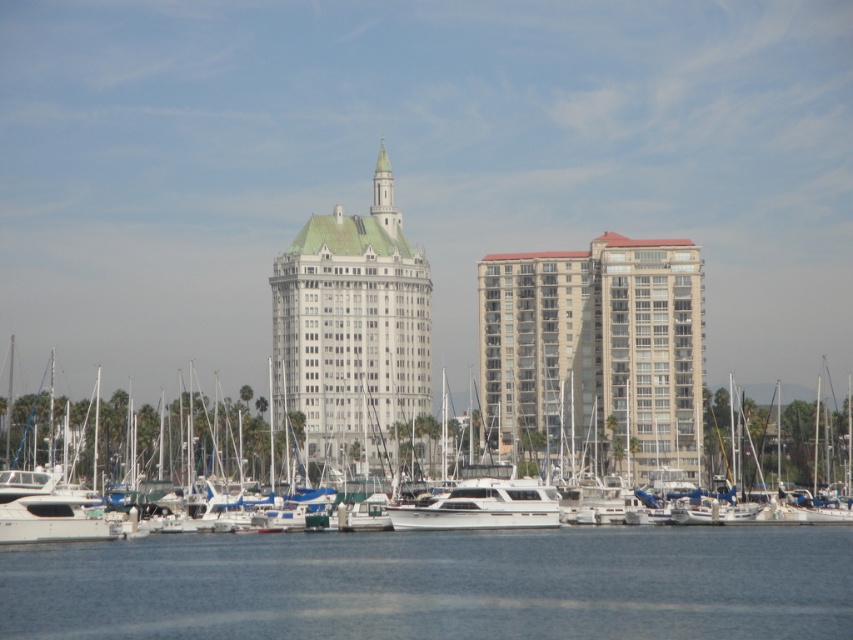
Is white glossy yacht at center positioned at the back of white glossy boat at center?

No, white glossy yacht at center is closer to the viewer.

Can you confirm if white glossy yacht at center is positioned to the left of white glossy boat at center?

Indeed, white glossy yacht at center is positioned on the left side of white glossy boat at center.

Locate an element on the screen. The width and height of the screenshot is (853, 640). white glossy yacht at center is located at coordinates (103, 429).

Can you confirm if clear blue water at lower center is positioned below beige glass building at center?

Yes.

Between clear blue water at lower center and beige glass building at center, which one appears on the left side from the viewer's perspective?

clear blue water at lower center

Is point (567, 541) positioned behind point (659, 259)?

No, it is in front of (659, 259).

Where is `clear blue water at lower center`? This screenshot has width=853, height=640. clear blue water at lower center is located at coordinates (438, 584).

Is point (581, 428) closer to viewer compared to point (143, 442)?

Yes.

This screenshot has height=640, width=853. What are the coordinates of `beige glass building at center` in the screenshot? It's located at (596, 346).

The width and height of the screenshot is (853, 640). What are the coordinates of `beige glass building at center` in the screenshot? It's located at (596, 346).